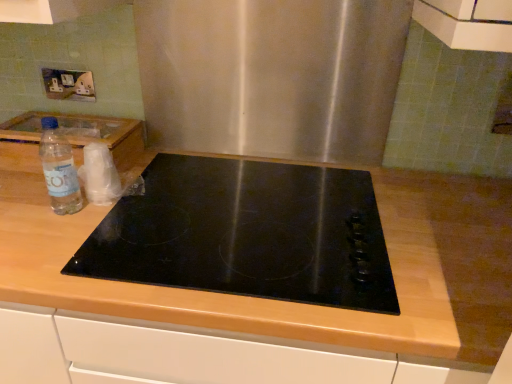
Question: Is there a large distance between black glass cooktop at center and wooden at center?

Choices:
 (A) no
 (B) yes

Answer: (A)

Question: Considering the relative sizes of black glass cooktop at center and wooden at center in the image provided, is black glass cooktop at center shorter than wooden at center?

Choices:
 (A) yes
 (B) no

Answer: (A)

Question: Is black glass cooktop at center at the right side of wooden at center?

Choices:
 (A) no
 (B) yes

Answer: (B)

Question: Can you confirm if black glass cooktop at center is thinner than wooden at center?

Choices:
 (A) no
 (B) yes

Answer: (B)

Question: Is black glass cooktop at center further to the viewer compared to wooden at center?

Choices:
 (A) yes
 (B) no

Answer: (A)

Question: Considering the positions of point (74, 258) and point (465, 266), is point (74, 258) closer or farther from the camera than point (465, 266)?

Choices:
 (A) farther
 (B) closer

Answer: (B)

Question: Is black glass cooktop at center situated inside wooden at center or outside?

Choices:
 (A) outside
 (B) inside

Answer: (B)

Question: Is black glass cooktop at center wider or thinner than wooden at center?

Choices:
 (A) thin
 (B) wide

Answer: (A)

Question: From a real-world perspective, is black glass cooktop at center above or below wooden at center?

Choices:
 (A) below
 (B) above

Answer: (B)

Question: Is white plastic electric outlet at upper left spatially inside clear plastic bottle at left, or outside of it?

Choices:
 (A) outside
 (B) inside

Answer: (A)

Question: Looking at their shapes, would you say white plastic electric outlet at upper left is wider or thinner than clear plastic bottle at left?

Choices:
 (A) wide
 (B) thin

Answer: (B)

Question: Based on their sizes in the image, would you say white plastic electric outlet at upper left is bigger or smaller than clear plastic bottle at left?

Choices:
 (A) big
 (B) small

Answer: (B)

Question: From their relative heights in the image, would you say white plastic electric outlet at upper left is taller or shorter than clear plastic bottle at left?

Choices:
 (A) short
 (B) tall

Answer: (A)

Question: Is point (54, 196) closer or farther from the camera than point (75, 79)?

Choices:
 (A) farther
 (B) closer

Answer: (B)

Question: Considering their positions, is clear plastic bottle at left located in front of or behind white plastic electric outlet at upper left?

Choices:
 (A) behind
 (B) front

Answer: (B)